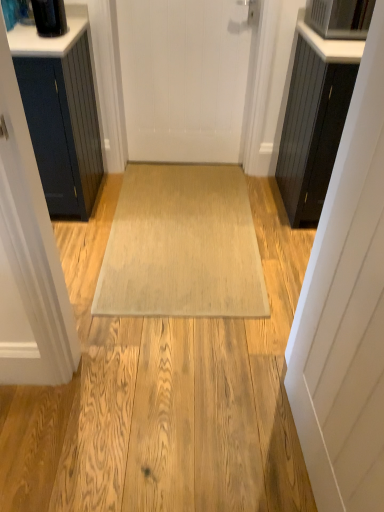
Find the location of `empty space that is ontop of beige woven mat at center (from a real-world perspective)`. empty space that is ontop of beige woven mat at center (from a real-world perspective) is located at coordinates (189, 227).